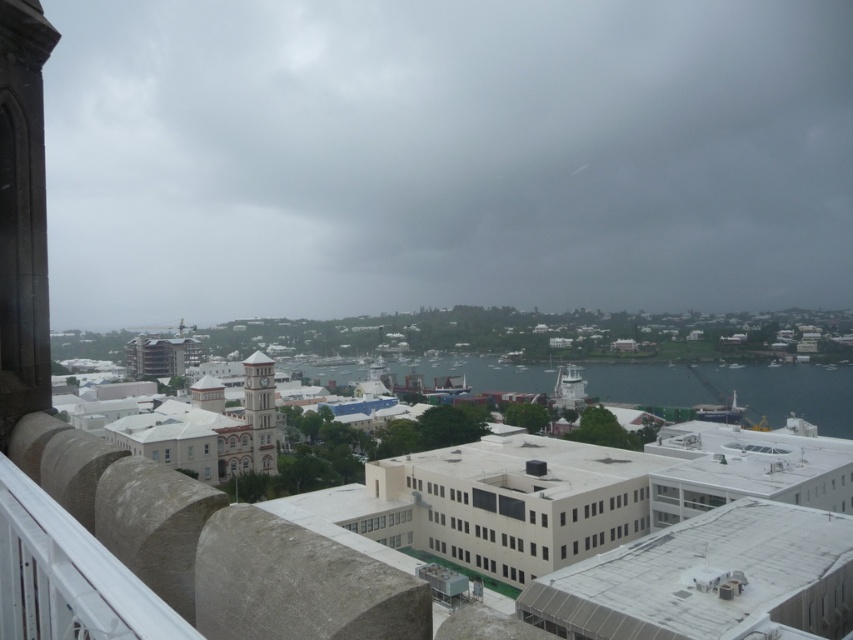
You are standing on the balcony and see the point marked as point (x=788, y=392). What is the nature of the surface at that point?

The point (x=788, y=392) corresponds to clear water at center, so the surface is clear water.

You are standing on a balcony overlooking the city. You see the clear water at center and the white stone clock tower at center. Which one is closer to you?

The clear water at center is closer to you because it is further to the viewer than the white stone clock tower at center.

You are standing on a balcony overlooking the city. You see the clear water at center and the white stone clock tower at center. Which one is located to the right of the other?

The clear water at center is positioned on the right side of white stone clock tower at center.